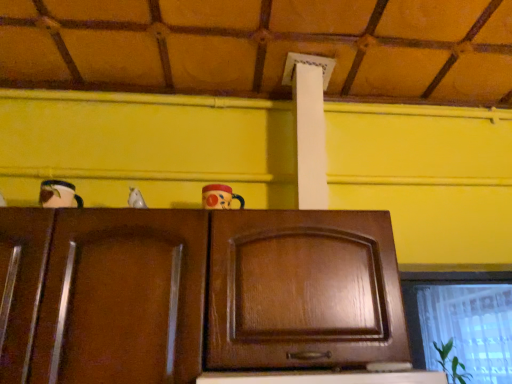
Question: Based on their positions, is dark brown wood cabinet at center located to the left or right of transparent plastic window at lower right?

Choices:
 (A) left
 (B) right

Answer: (A)

Question: From a real-world perspective, is dark brown wood cabinet at center physically located above or below transparent plastic window at lower right?

Choices:
 (A) above
 (B) below

Answer: (B)

Question: Is dark brown wood cabinet at center inside or outside of transparent plastic window at lower right?

Choices:
 (A) inside
 (B) outside

Answer: (B)

Question: From the image's perspective, is transparent plastic window at lower right positioned above or below dark brown wood cabinet at center?

Choices:
 (A) above
 (B) below

Answer: (B)

Question: In terms of size, does transparent plastic window at lower right appear bigger or smaller than dark brown wood cabinet at center?

Choices:
 (A) small
 (B) big

Answer: (B)

Question: From a real-world perspective, relative to dark brown wood cabinet at center, is transparent plastic window at lower right vertically above or below?

Choices:
 (A) below
 (B) above

Answer: (B)

Question: Which is correct: transparent plastic window at lower right is inside dark brown wood cabinet at center, or outside of it?

Choices:
 (A) inside
 (B) outside

Answer: (B)